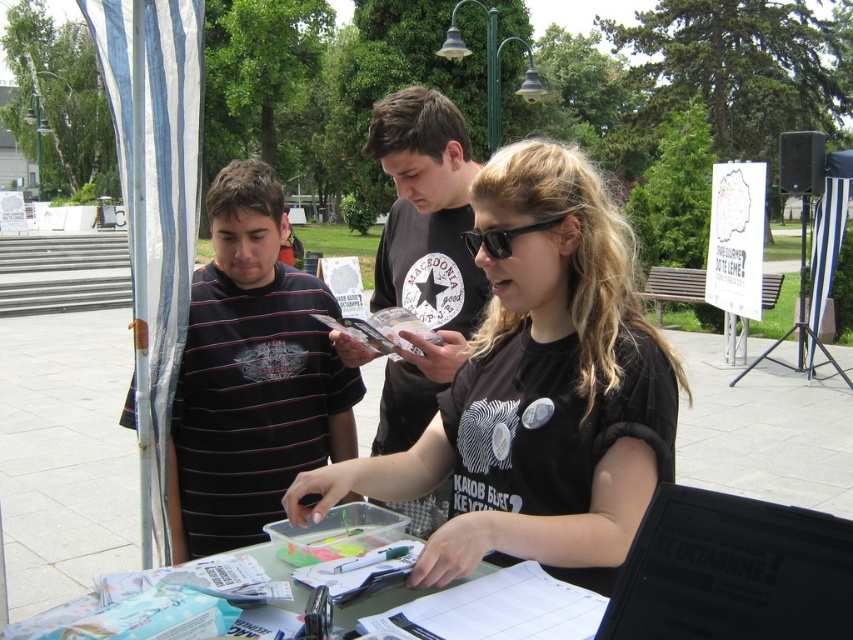
You are organizing a community event and need to place a 1.2 meter wide banner between the black striped shirt at left and the black plastic laptop at lower right. Can the space between them accommodate the banner?

The black striped shirt at left is wider than the black plastic laptop at lower right. However, the total space between them isn